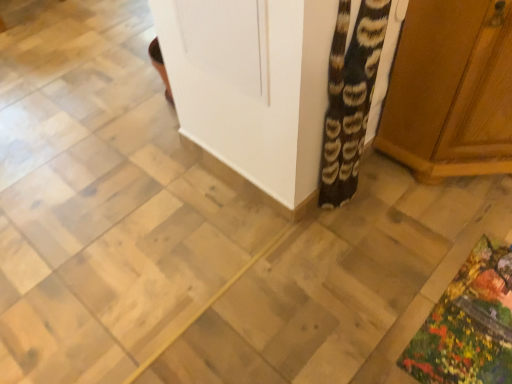
The width and height of the screenshot is (512, 384). I want to click on vacant space to the left of black and white patterned blanket at center, so click(284, 228).